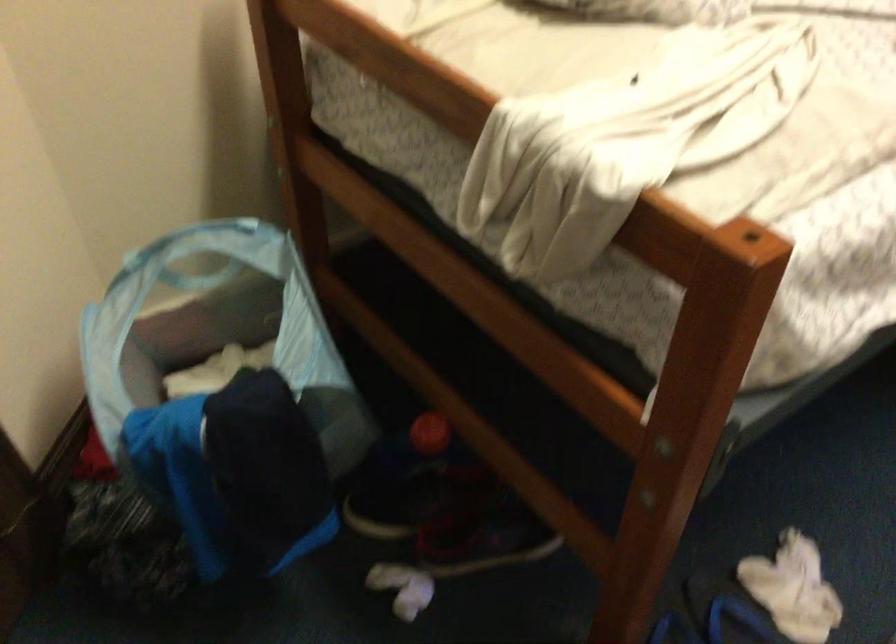
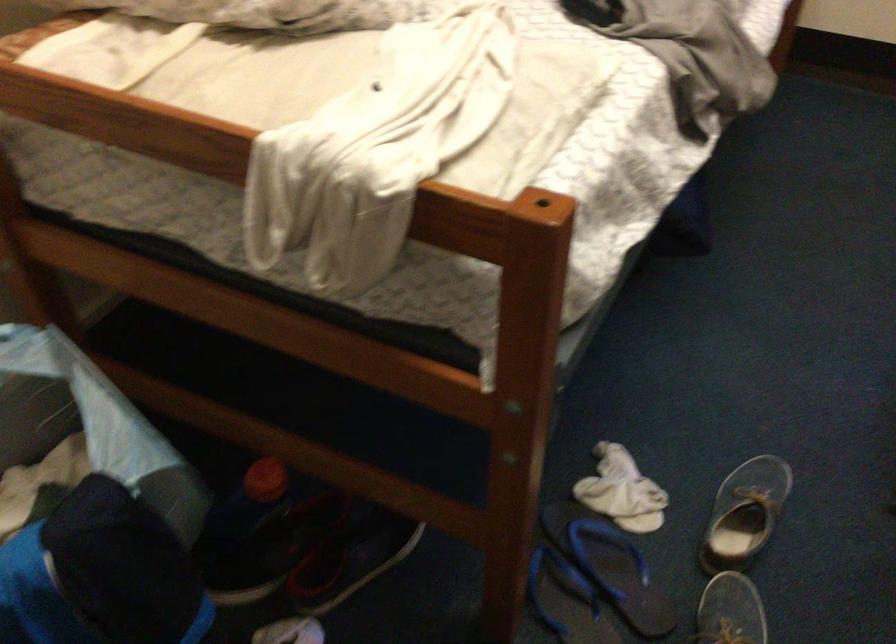
The point at (426,436) is marked in the first image. Where is the corresponding point in the second image?

(264, 480)